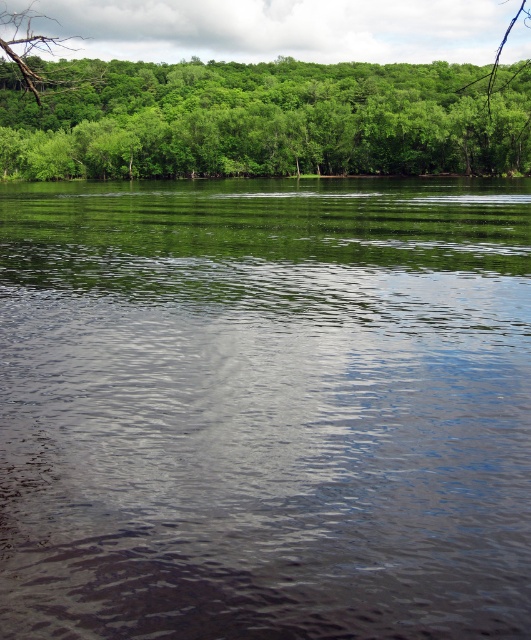
You are standing in the tranquil natural scene and want to walk from the point closer to you to the point further away. Which path would you take between the two points, point(x=177, y=582) and point(x=21, y=10)?

You should take the path from point(x=177, y=582) to point(x=21, y=10) since point(x=177, y=582) is closer to the viewer and you want to walk towards the point(x=21, y=10) which is further away.

You are a bird flying over the scene and want to land on the green leafy tree at upper center. From your current position above the clear water at center, which direction should you fly to reach the tree?

The clear water at center is in front of the green leafy tree at upper center, so to reach the tree, you should fly backward away from the water towards the tree.

You are a photographer standing at the edge of the water. You want to capture the reflection of the trees in the clear water at center. Based on the water surface position, where should you aim your camera to ensure the reflection is centered in your shot?

The clear water at center is located at point 2D coordinates (264, 408). To center the reflection of the trees in your shot, aim your camera at those coordinates.